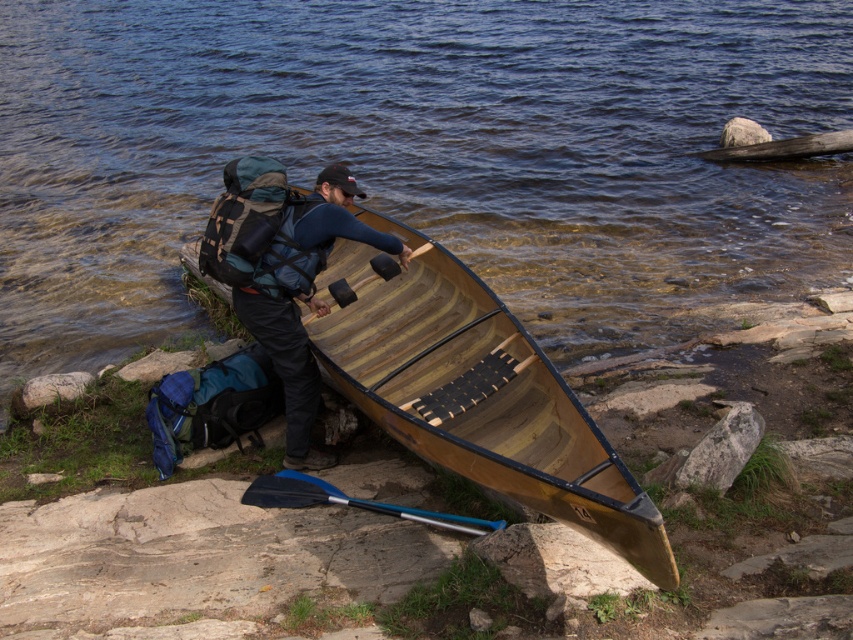
You are planning to carry your gear from the wooden canoe at center to the clear water at center. Considering their widths, which one is wider?

The clear water at center is wider than the wooden canoe at center, so the clear water at center is wider.

You are standing at the point marked as point (228, 141), which is 14.77 meters away from you. You want to place a 10 meter long rope from your current position to the point. Is the rope long enough?

The distance of point (228, 141) from viewer is 14.77 meters. The rope is only 10 meters long, so it is not long enough to reach the point.

You are standing at the point marked as point [343,234] in the image. You want to walk to the nearest tree, which is located 5 meters away from you. Can you reach the tree without walking more than 5 meters?

The distance between you and the point marked as point [343,234] is 4.92 meters. Since the nearest tree is 5 meters away from you, you can reach it without exceeding the 5 meter limit.